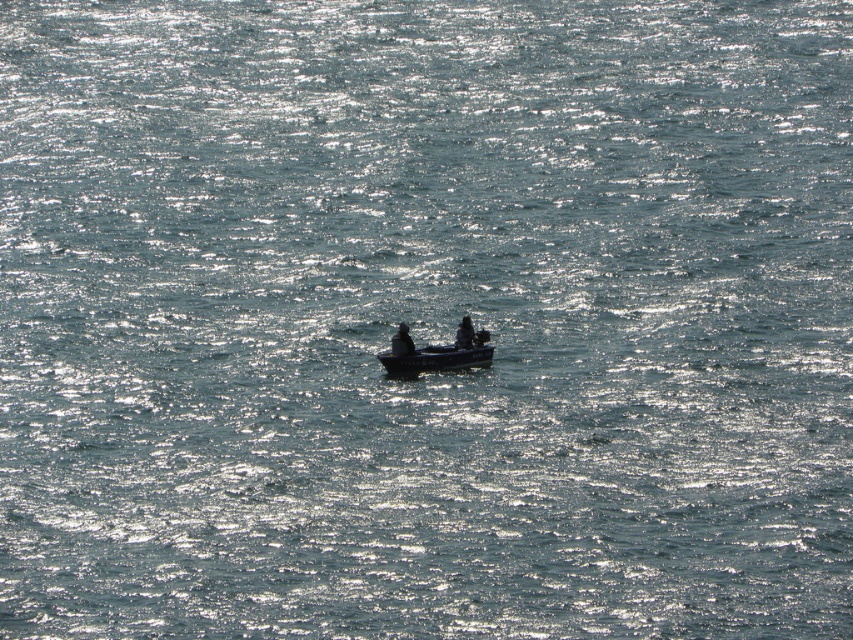
Is smooth dark wood canoe at center to the right of dark gray fabric jacket at center from the viewer's perspective?

Incorrect, smooth dark wood canoe at center is not on the right side of dark gray fabric jacket at center.

Can you confirm if smooth dark wood canoe at center is positioned above dark gray fabric jacket at center?

No, smooth dark wood canoe at center is not above dark gray fabric jacket at center.

You are a GUI agent. You are given a task and a screenshot of the screen. Output one action in this format:
    pyautogui.click(x=<x>, y=<y>)
    Task: Click on the smooth dark wood canoe at center
    The image size is (853, 640).
    Given the screenshot: What is the action you would take?
    pyautogui.click(x=434, y=358)

Who is more distant from viewer, (403,330) or (473,342)?

The point (403,330) is more distant.

Does point (410, 346) come closer to viewer compared to point (462, 324)?

Yes, point (410, 346) is in front of point (462, 324).

Image resolution: width=853 pixels, height=640 pixels. I want to click on dark hair at center, so click(401, 340).

This screenshot has width=853, height=640. In order to click on dark hair at center in this screenshot , I will do `click(401, 340)`.

Can you confirm if smooth dark wood canoe at center is positioned to the right of dark hair at center?

Yes, smooth dark wood canoe at center is to the right of dark hair at center.

Where is `smooth dark wood canoe at center`? Image resolution: width=853 pixels, height=640 pixels. smooth dark wood canoe at center is located at coordinates (434, 358).